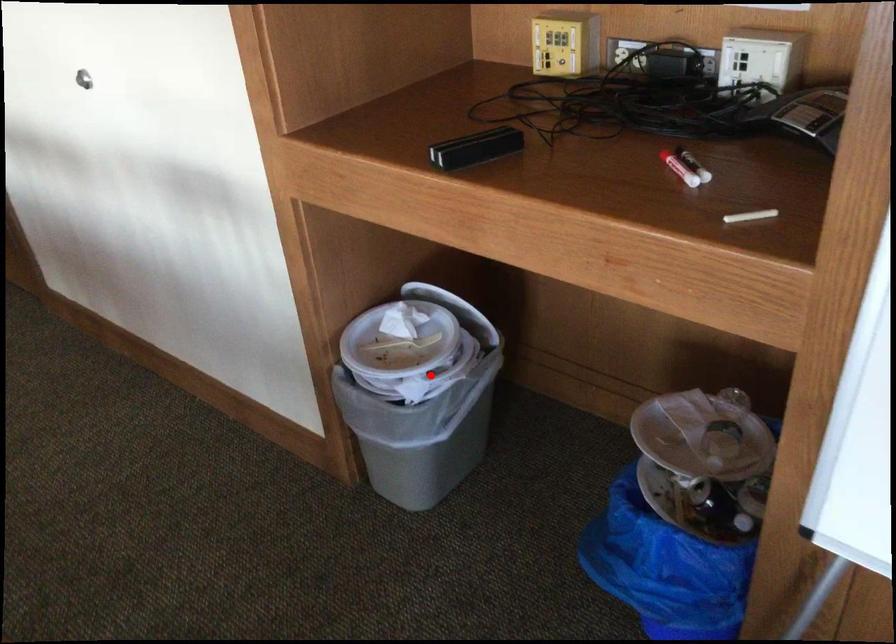
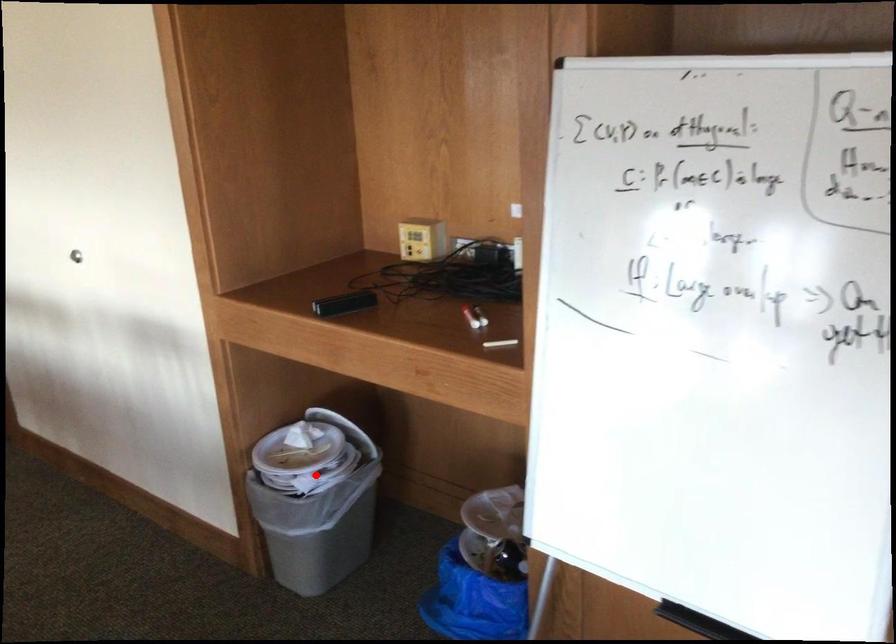
I am providing you with two images of the same scene from different viewpoints. A red point is marked on the first image and another point is marked on the second image. Is the marked point in image1 the same physical position as the marked point in image2?

Yes